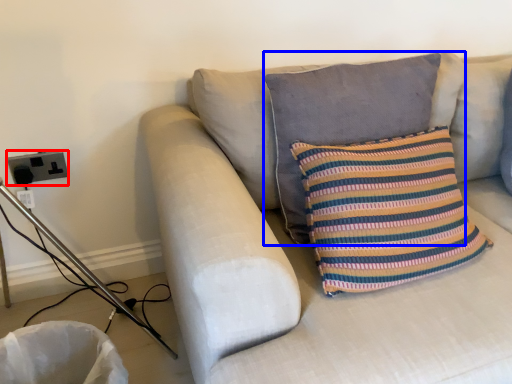
Question: Which point is further to the camera, electric outlet (highlighted by a red box) or pillow (highlighted by a blue box)?

Choices:
 (A) electric outlet
 (B) pillow

Answer: (A)